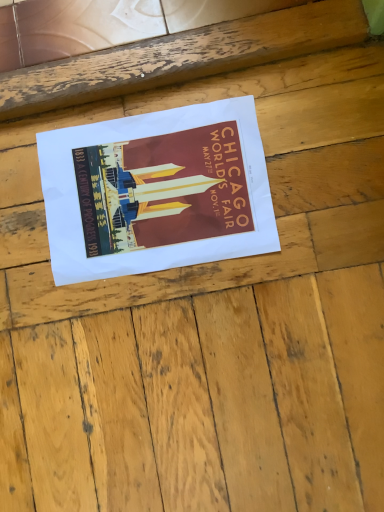
Where is `free space that is to the left of matte paper poster at center`? Image resolution: width=384 pixels, height=512 pixels. free space that is to the left of matte paper poster at center is located at coordinates (38, 286).